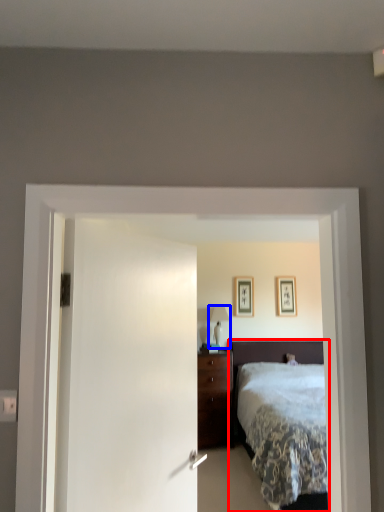
Question: Which object is further to the camera taking this photo, bed (highlighted by a red box) or table lamp (highlighted by a blue box)?

Choices:
 (A) bed
 (B) table lamp

Answer: (B)